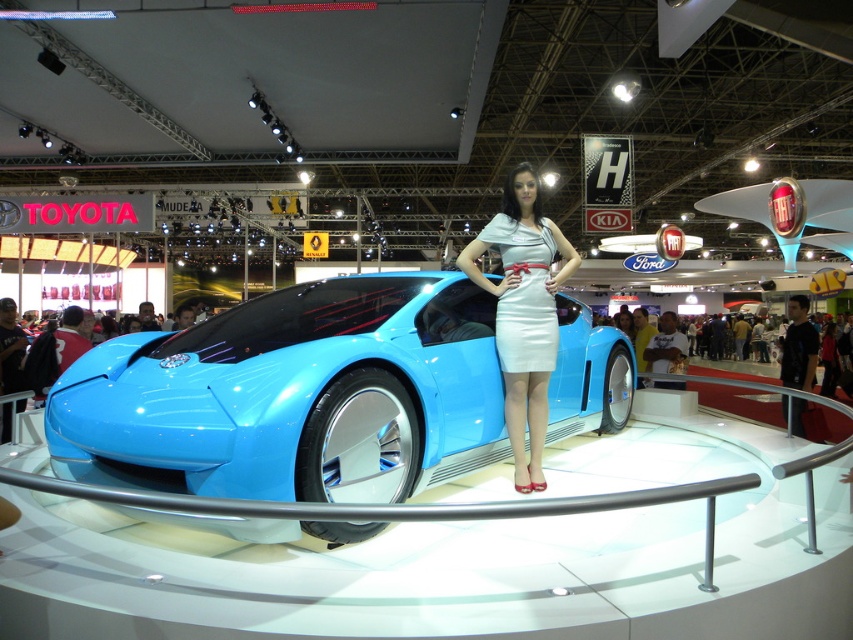
You are a photographer at the auto show and want to capture a photo of the glossy blue car at center and the white satin dress at center. Based on their positions, which object is located above the other?

The glossy blue car at center is positioned under the white satin dress at center, so the white satin dress at center is above the glossy blue car at center.

You are a photographer at the auto show. You want to take a photo of the glossy blue car at center and the white satin dress at center from the front. Can you position yourself so that both are fully visible in the frame without any part of them being blocked by the other?

The glossy blue car at center is in front of the white satin dress at center, so positioning yourself directly in front would result in the car blocking the dress. To ensure both are fully visible, you need to adjust your angle so that neither object obscures the other.